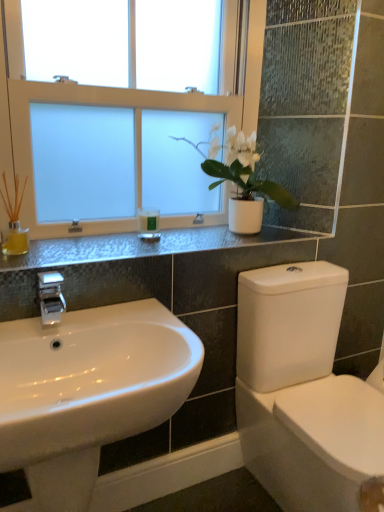
Identify the location of vacant area to the left of silver metallic faucet at left. (24, 327).